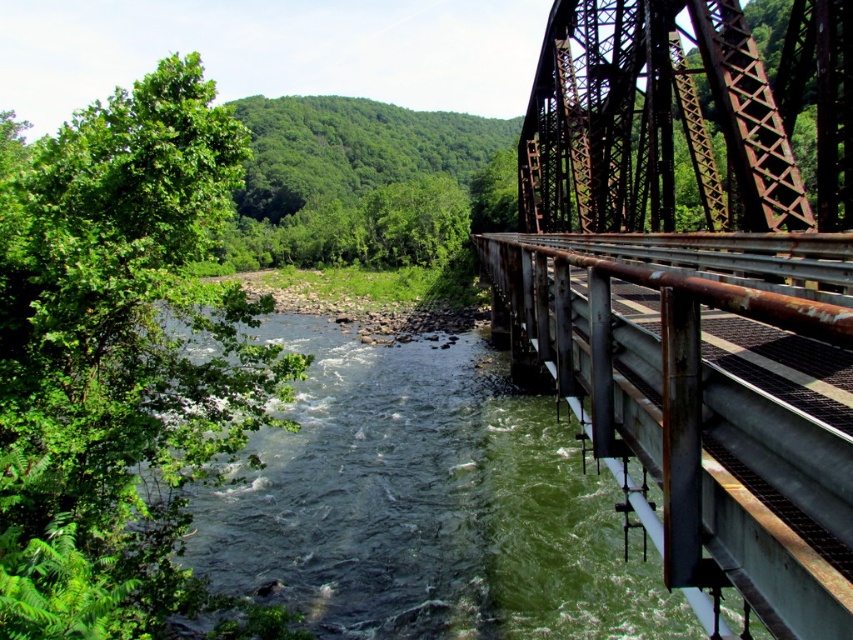
Question: Is rusty metal bridge at right behind green water at center?

Choices:
 (A) yes
 (B) no

Answer: (B)

Question: Which of the following is the farthest from the observer?

Choices:
 (A) rusty metal bridge at right
 (B) green water at center

Answer: (B)

Question: Can you confirm if rusty metal bridge at right is bigger than green water at center?

Choices:
 (A) yes
 (B) no

Answer: (A)

Question: Which object appears closest to the camera in this image?

Choices:
 (A) rusty metal bridge at right
 (B) green water at center

Answer: (A)

Question: Can you confirm if rusty metal bridge at right is positioned below green water at center?

Choices:
 (A) yes
 (B) no

Answer: (B)

Question: Which point is farther to the camera?

Choices:
 (A) (227, 554)
 (B) (593, 220)

Answer: (B)